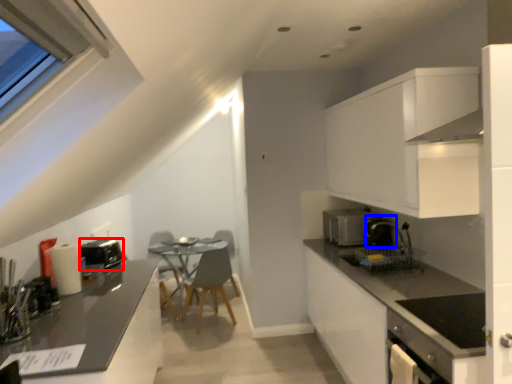
Question: Which of the following is the farthest to the observer, appliance (highlighted by a red box) or coffee machine (highlighted by a blue box)?

Choices:
 (A) appliance
 (B) coffee machine

Answer: (B)